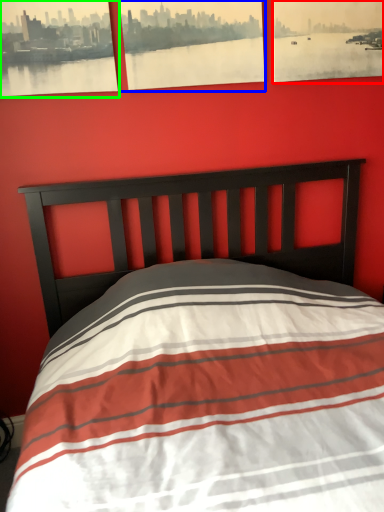
Question: Estimate the real-world distances between objects in this image. Which object is farther from picture frame (highlighted by a red box), picture frame (highlighted by a blue box) or picture frame (highlighted by a green box)?

Choices:
 (A) picture frame
 (B) picture frame

Answer: (B)